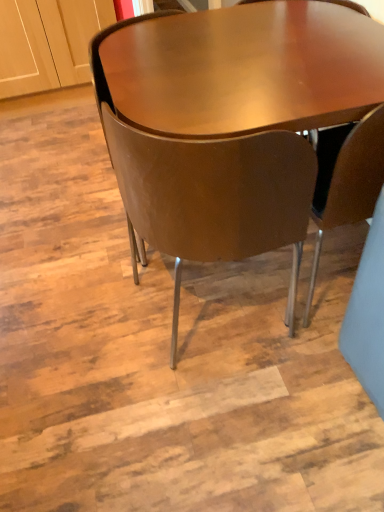
Where is `vacant space positioned to the left of brown leather chair at center, marked as the first chair in a left-to-right arrangement`? Image resolution: width=384 pixels, height=512 pixels. vacant space positioned to the left of brown leather chair at center, marked as the first chair in a left-to-right arrangement is located at coordinates (86, 230).